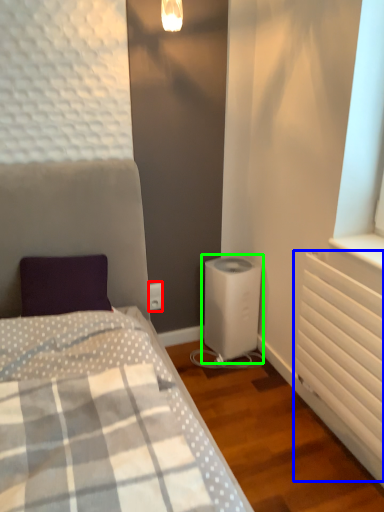
Question: Based on their relative distances, which object is nearer to electric outlet (highlighted by a red box)? Choose from radiator (highlighted by a blue box) and water heater (highlighted by a green box).

Choices:
 (A) radiator
 (B) water heater

Answer: (B)